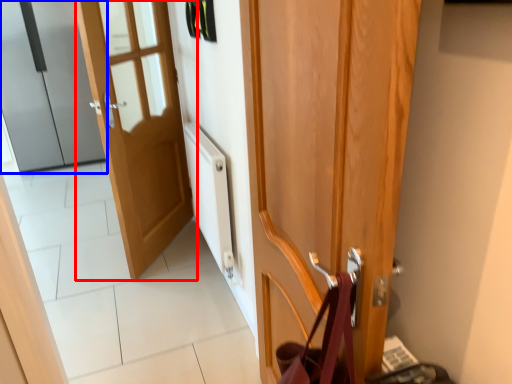
Question: Which of the following is the farthest to the observer, door (highlighted by a red box) or door (highlighted by a blue box)?

Choices:
 (A) door
 (B) door

Answer: (B)